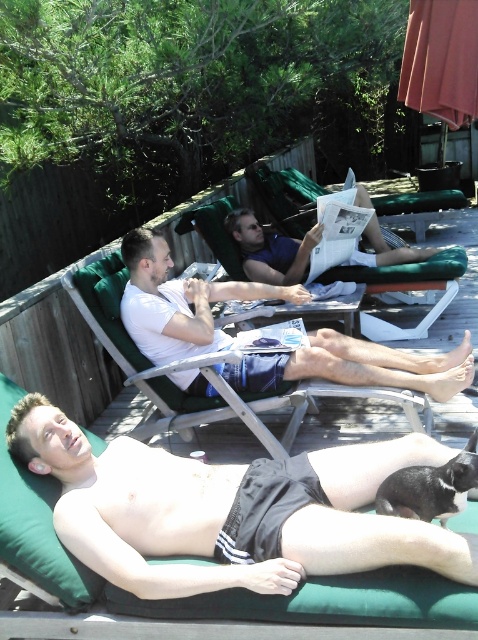
Is black matte shorts at center shorter than green fabric deck at lower left?

Indeed, black matte shorts at center has a lesser height compared to green fabric deck at lower left.

Looking at this image, is black matte shorts at center above green fabric deck at lower left?

Correct, black matte shorts at center is located above green fabric deck at lower left.

At what (x,y) coordinates should I click in order to perform the action: click on black matte shorts at center. Please return your answer as a coordinate pair (x, y). Looking at the image, I should click on (229, 509).

Is point (324, 276) positioned behind point (243, 209)?

Yes.

Does green fabric beach chair at center appear on the left side of blue fabric chair at center?

Incorrect, green fabric beach chair at center is not on the left side of blue fabric chair at center.

What do you see at coordinates (401, 280) in the screenshot? This screenshot has width=478, height=640. I see `green fabric beach chair at center` at bounding box center [401, 280].

In order to click on green fabric beach chair at center in this screenshot , I will do pyautogui.click(x=401, y=280).

Does black matte shorts at center appear over blue fabric chair at center?

Actually, black matte shorts at center is below blue fabric chair at center.

Based on the photo, does black matte shorts at center have a lesser width compared to blue fabric chair at center?

In fact, black matte shorts at center might be wider than blue fabric chair at center.

Is point (158, 593) farther from viewer compared to point (260, 260)?

No, (158, 593) is closer to viewer.

Where is `black matte shorts at center`? black matte shorts at center is located at coordinates (229, 509).